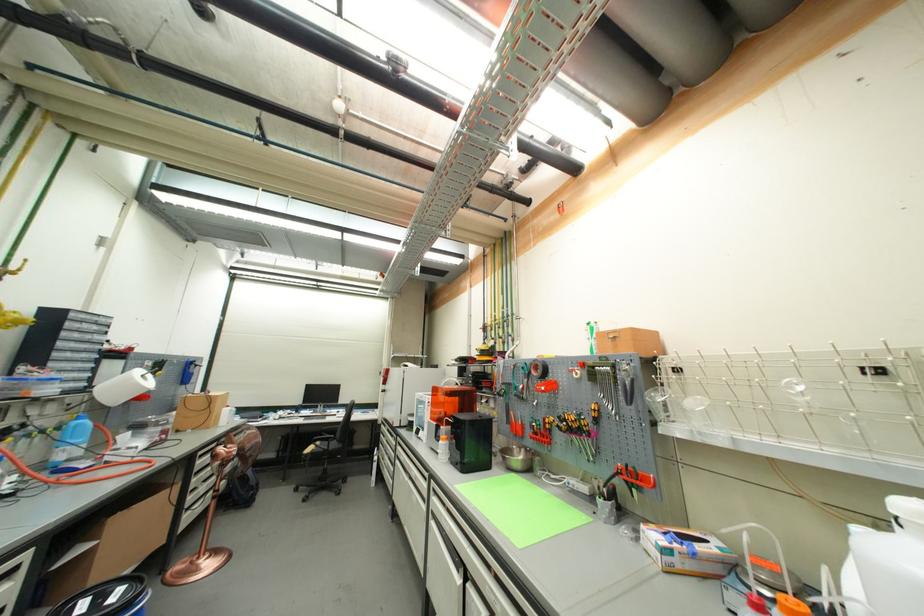
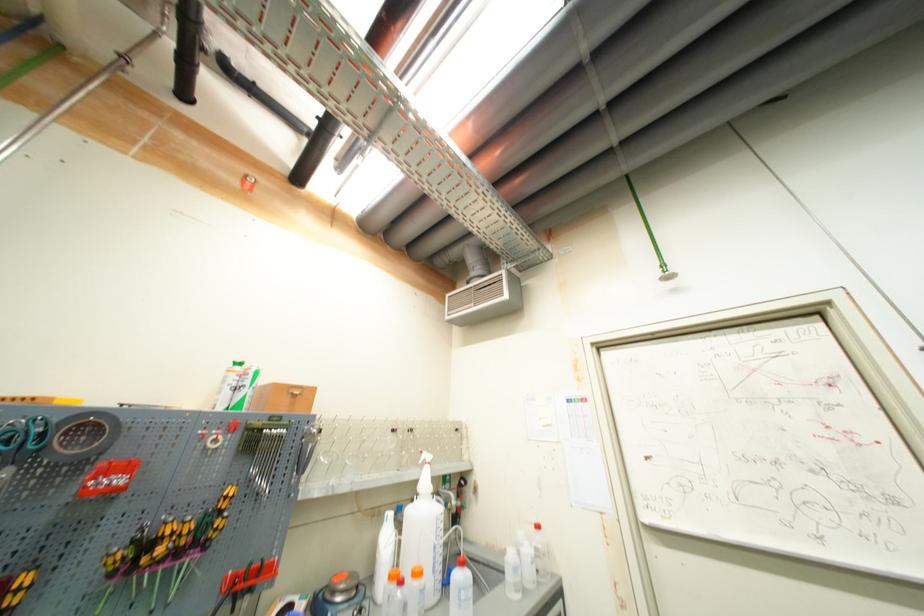
The point at (x=615, y=342) is marked in the first image. Where is the corresponding point in the second image?

(295, 398)